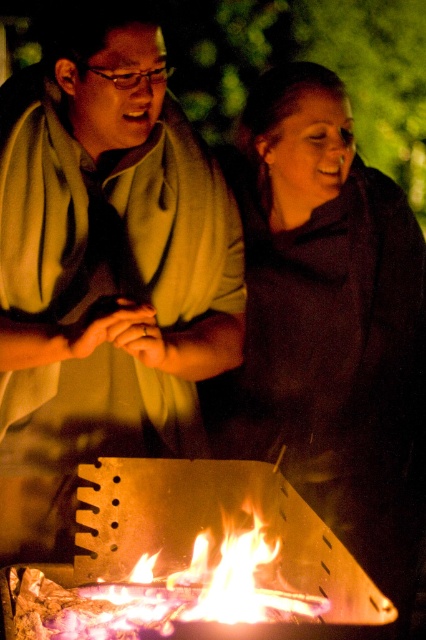
You are standing at the campfire and want to place a marshmallow stick between the two points, point (189, 428) and point (178, 612). Since you want the marshmallow to be closer to the fire, which point should you choose?

Point (178, 612) is in front of point (189, 428), so placing the marshmallow stick at point (178, 612) would position it closer to the fire.

You are a photographer trying to capture a clear shot of the matte green scarf at center and the flaming wood at center. Which object should you focus on first to ensure it appears larger in the photo?

The matte green scarf at center is much taller than the flaming wood at center, so focusing on it first will ensure it appears larger in the photo.